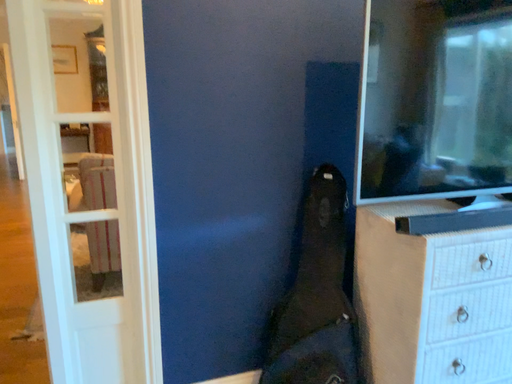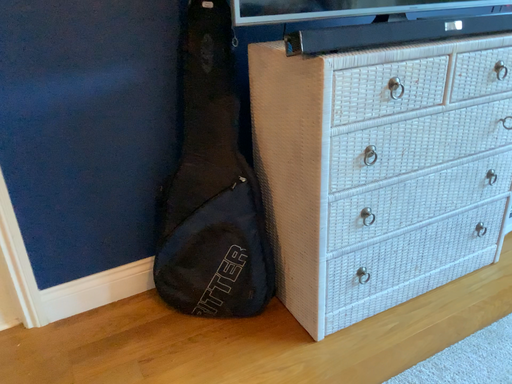
Question: Which way did the camera rotate in the video?

Choices:
 (A) rotated right
 (B) rotated left

Answer: (A)